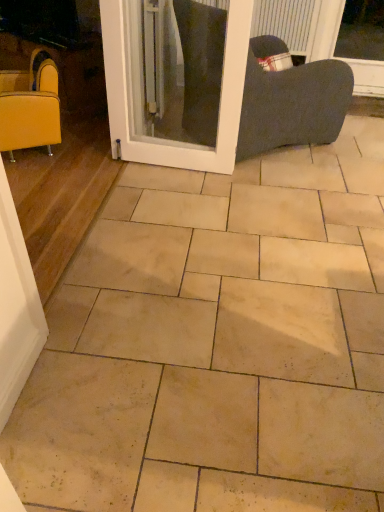
At what (x,y) coordinates should I click in order to perform the action: click on space that is in front of white glossy screen door at center. Please return your answer as a coordinate pair (x, y). Looking at the image, I should click on (171, 199).